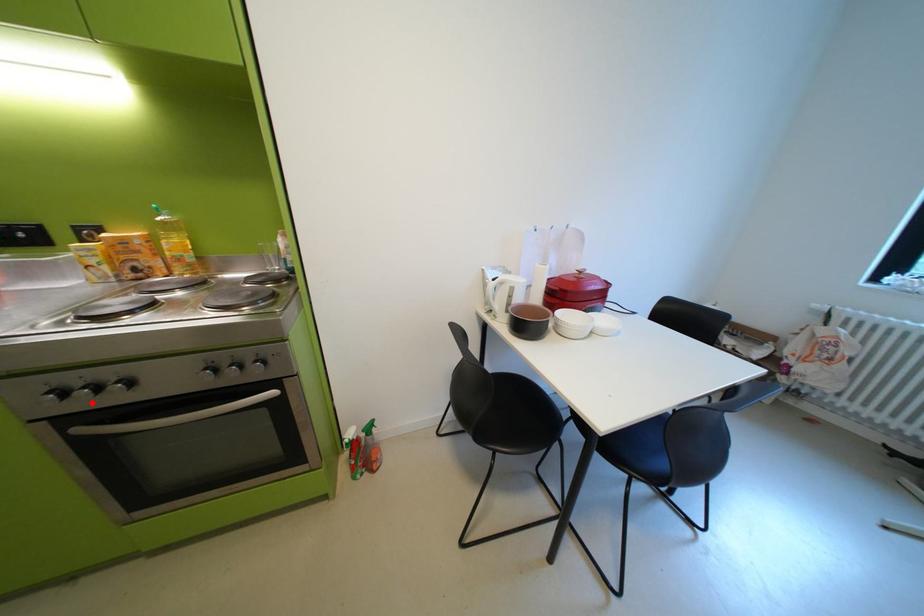
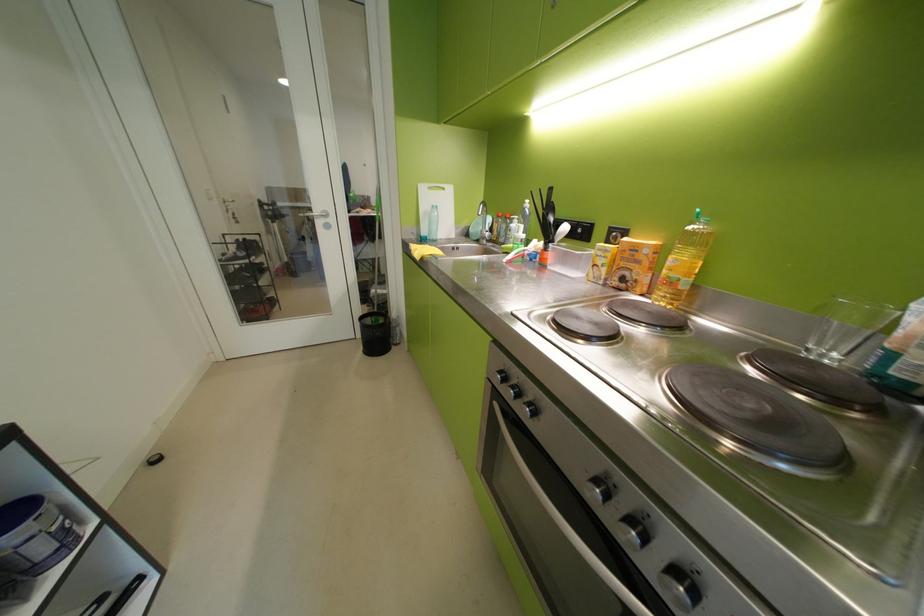
Where in the second image is the point corresponding to the highlighted location from the first image?

(517, 394)